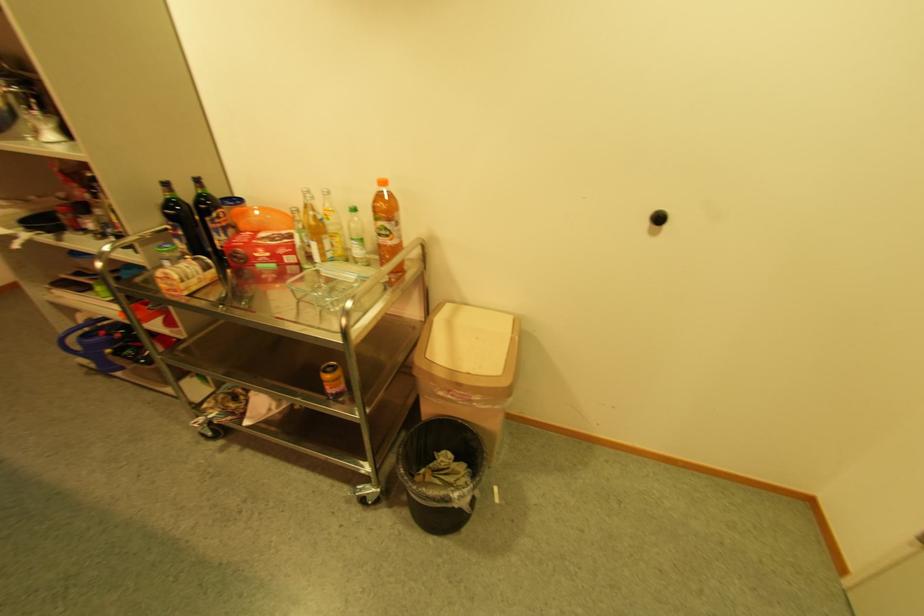
The image size is (924, 616). Describe the element at coordinates (469, 339) in the screenshot. I see `the beige trash can lid` at that location.